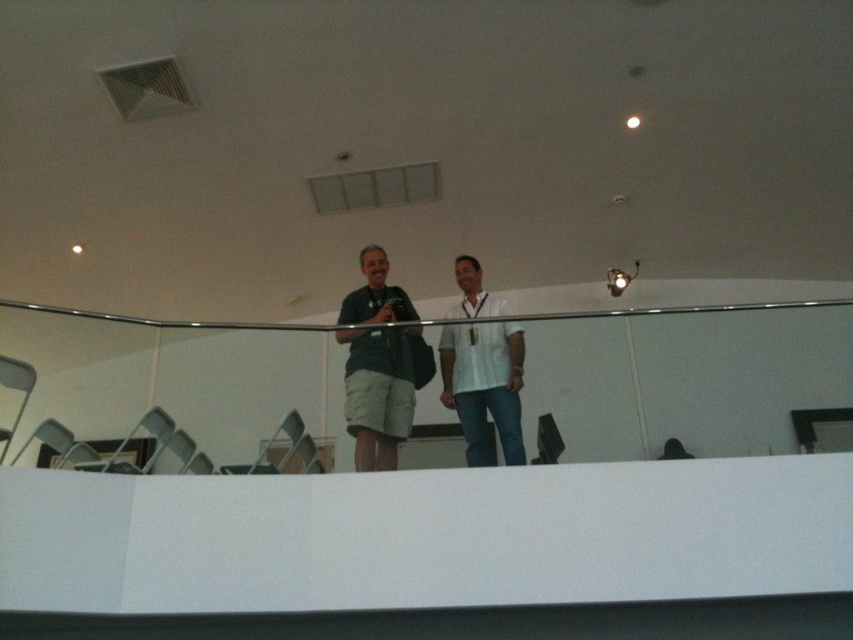
You are standing on the balcony and want to hand a note to the person wearing the dark green fabric shirt at center and the white striped shirt at center. Which person should you hand the note to first to avoid having to walk further?

You should hand the note to the dark green fabric shirt at center first since they are closer to you than the white striped shirt at center, so you don

You are standing on a balcony and see two people wearing shirts. The dark green fabric shirt at center and the white striped shirt at center. Which shirt is positioned to the left?

The dark green fabric shirt at center is positioned to the left of the white striped shirt at center.

You are a security guard in the building and need to ensure that the dark green fabric shirt at center and the white striped shirt at center are maintaining a safe distance of at least 18 inches apart for social distancing. Based on the image, are they complying with the requirement?

The dark green fabric shirt at center is 17.14 inches from the white striped shirt at center, which is less than the required 18 inches. Therefore, they are not complying with the social distancing requirement.